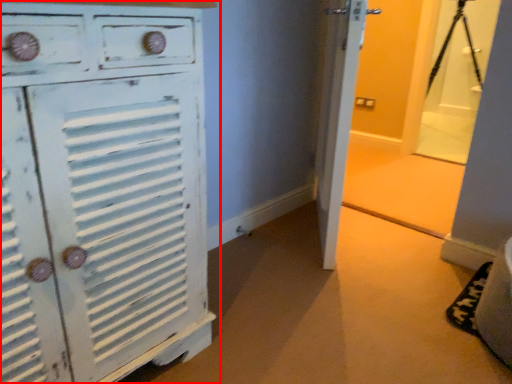
Question: From the image's perspective, considering the relative positions of chest of drawers (annotated by the red box) and tripod in the image provided, where is chest of drawers (annotated by the red box) located with respect to the staircase?

Choices:
 (A) above
 (B) below

Answer: (B)